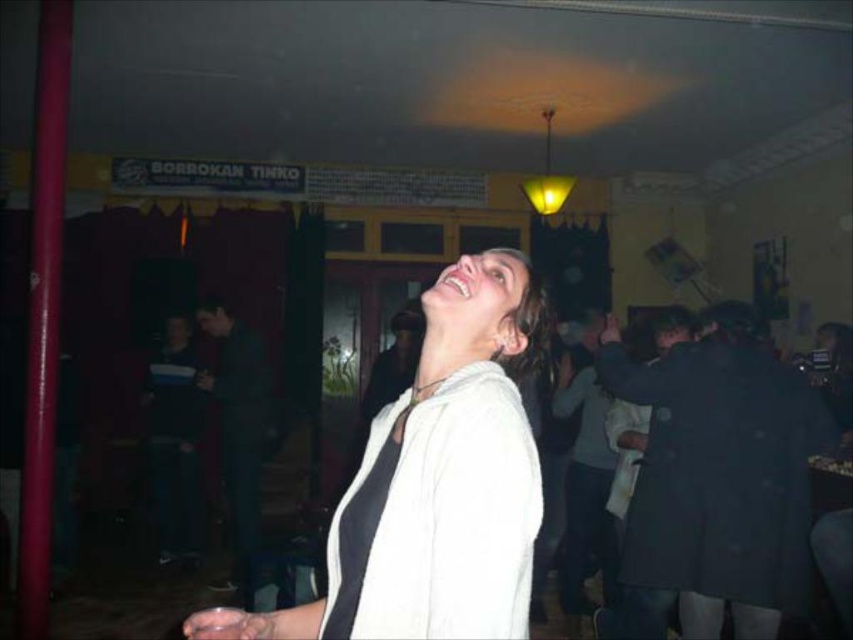
You are at a party and want to take a photo of the white matte jacket at center and the black matte sweatshirt at right. Since you want both in focus, which one should you focus on first?

The white matte jacket at center is in front of the black matte sweatshirt at right, so you should focus on the white matte jacket at center first to ensure both are in focus.

You are at a party and see the white matte jacket at center and the black matte sweatshirt at right. Which clothing item is covering the other one?

The white matte jacket at center is positioned over the black matte sweatshirt at right, so it is covering it.

You are at a party and see two sweatshirts in the scene. The black matte sweatshirt at right and the white soft sweatshirt at center. Which one is located to the right of the other?

The black matte sweatshirt at right is positioned on the right side of white soft sweatshirt at center.